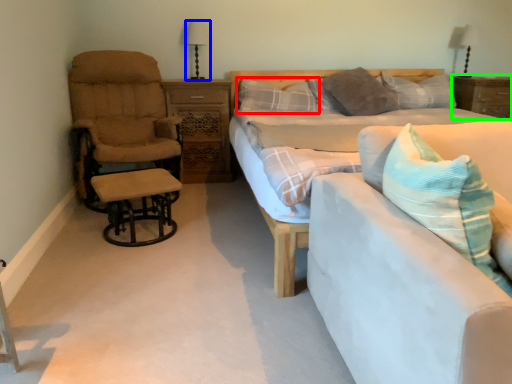
Question: Which object is the closest to the pillow (highlighted by a red box)? Choose among these: table lamp (highlighted by a blue box) or nightstand (highlighted by a green box).

Choices:
 (A) table lamp
 (B) nightstand

Answer: (A)